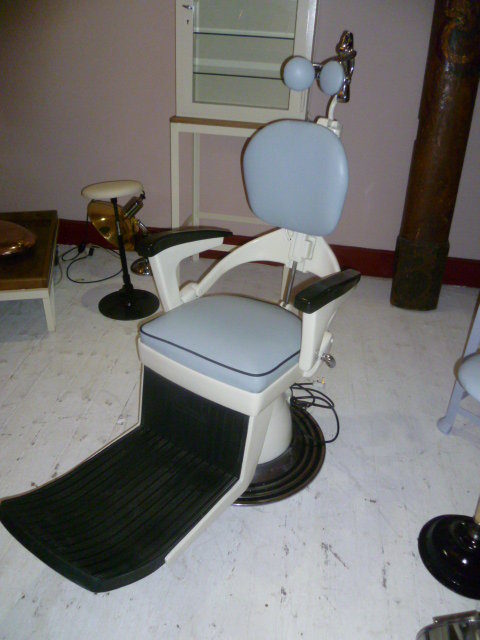
Locate an element on the screen. Image resolution: width=480 pixels, height=640 pixels. stool is located at coordinates (117, 189).